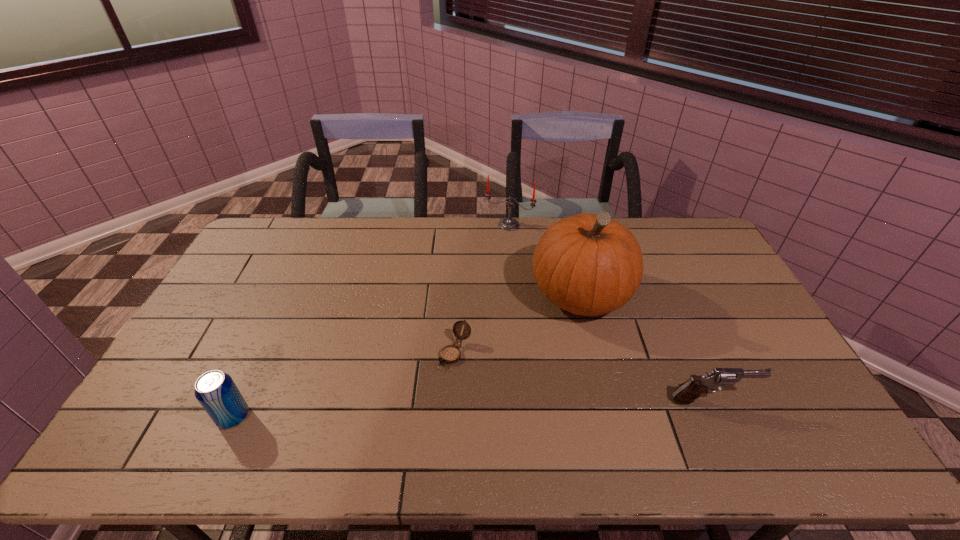
Locate an element on the screen. free space in the image that satisfies the following two spatial constraints: 1. on the front side of the fourth object from right to left; 2. at the barrel of the rightmost object is located at coordinates [453, 400].

This screenshot has width=960, height=540. What are the coordinates of `free location that satisfies the following two spatial constraints: 1. on the back side of the fourth shortest object; 2. on the left side of the third farthest object` in the screenshot? It's located at click(462, 225).